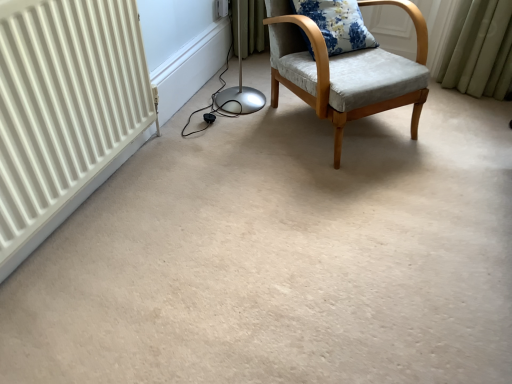
Question: Would you say floral fabric cushion at upper right contains light gray fabric chair at center?

Choices:
 (A) yes
 (B) no

Answer: (B)

Question: From a real-world perspective, is floral fabric cushion at upper right positioned under light gray fabric chair at center based on gravity?

Choices:
 (A) no
 (B) yes

Answer: (A)

Question: Could you tell me if floral fabric cushion at upper right is turned towards light gray fabric chair at center?

Choices:
 (A) yes
 (B) no

Answer: (A)

Question: Considering the relative positions of floral fabric cushion at upper right and light gray fabric chair at center in the image provided, is floral fabric cushion at upper right behind light gray fabric chair at center?

Choices:
 (A) no
 (B) yes

Answer: (B)

Question: Considering the relative positions of floral fabric cushion at upper right and light gray fabric chair at center in the image provided, is floral fabric cushion at upper right to the left of light gray fabric chair at center from the viewer's perspective?

Choices:
 (A) no
 (B) yes

Answer: (B)

Question: Is floral fabric cushion at upper right positioned with its back to light gray fabric chair at center?

Choices:
 (A) no
 (B) yes

Answer: (B)

Question: Considering the relative sizes of white plastic electric outlet at upper center and light gray fabric chair at center in the image provided, is white plastic electric outlet at upper center thinner than light gray fabric chair at center?

Choices:
 (A) no
 (B) yes

Answer: (B)

Question: From the image's perspective, is white plastic electric outlet at upper center located above light gray fabric chair at center?

Choices:
 (A) yes
 (B) no

Answer: (A)

Question: Is white plastic electric outlet at upper center far away from light gray fabric chair at center?

Choices:
 (A) no
 (B) yes

Answer: (A)

Question: Is white plastic electric outlet at upper center outside light gray fabric chair at center?

Choices:
 (A) no
 (B) yes

Answer: (B)

Question: Can you confirm if white plastic electric outlet at upper center is positioned to the right of light gray fabric chair at center?

Choices:
 (A) yes
 (B) no

Answer: (B)

Question: Is light gray fabric chair at center a part of white plastic electric outlet at upper center?

Choices:
 (A) no
 (B) yes

Answer: (A)

Question: Does white plastic electric outlet at upper center appear on the left side of floral fabric cushion at upper right?

Choices:
 (A) yes
 (B) no

Answer: (A)